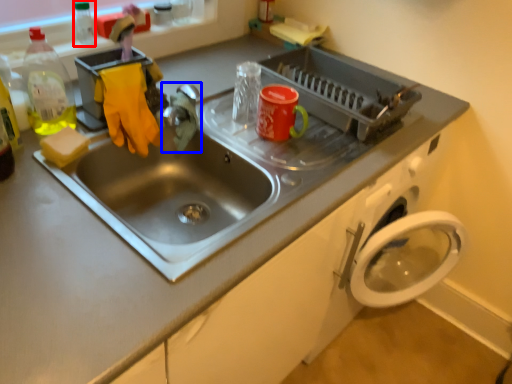
Question: Among these objects, which one is farthest to the camera, bottle (highlighted by a red box) or faucet (highlighted by a blue box)?

Choices:
 (A) bottle
 (B) faucet

Answer: (A)